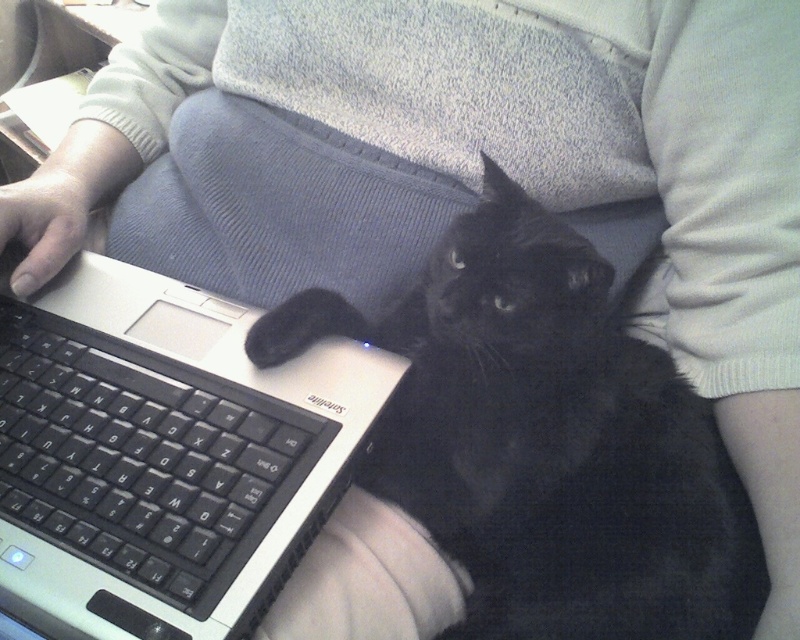
Who is more forward, (644, 358) or (197, 396)?

Point (197, 396)

The height and width of the screenshot is (640, 800). What do you see at coordinates (546, 440) in the screenshot? I see `black fur cat at center` at bounding box center [546, 440].

This screenshot has width=800, height=640. I want to click on black fur cat at center, so click(546, 440).